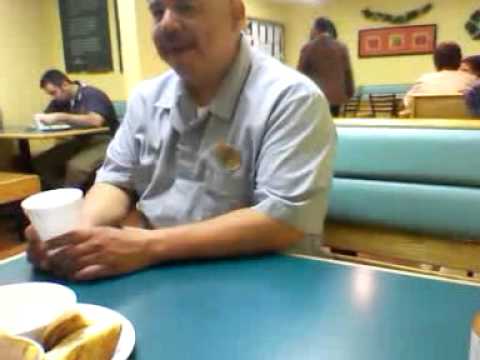
Find the location of a particular element. The image size is (480, 360). blue table top is located at coordinates (204, 280), (300, 322), (383, 89).